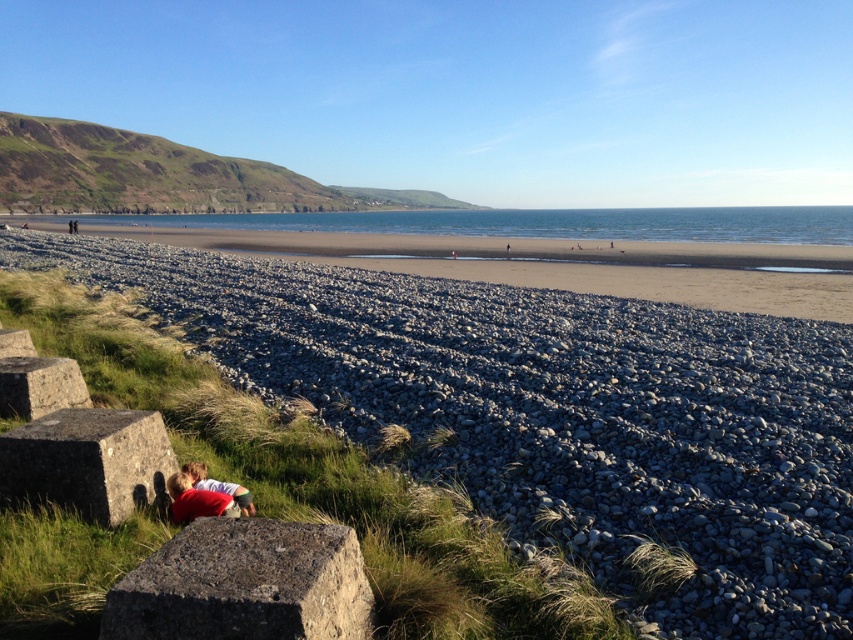
You are a photographer trying to capture a photo of the gray rough stone at lower left and the red cotton shirt at lower left. Since you want both subjects to appear clearly in the frame, which object should you focus on first to ensure depth of field?

You should focus on the gray rough stone at lower left first because it is much taller than the red cotton shirt at lower left, ensuring both are in focus when using depth of field techniques.

You are a photographer trying to capture the red cotton shirt at lower left and the smooth gray rock at lower left in the same frame. Based on their positions, which object should you focus on first if you want both to be in focus?

The red cotton shirt at lower left is below smooth gray rock at lower left, so you should focus on the smooth gray rock at lower left first to ensure both are in focus.

You are a photographer setting up equipment on the beach. You have two items to place in the scene. You need to position a camera on the gray stone at lower left and a tripod on the smooth gray rock at lower left. Since both are at lower left, how should you arrange them so that the camera is closer to you than the tripod?

Place the camera on the gray stone at lower left and the tripod on the smooth gray rock at lower left because the gray stone at lower left is closer to the viewer than the smooth gray rock at lower left, ensuring the camera is nearer to you while the tripod is slightly behind.